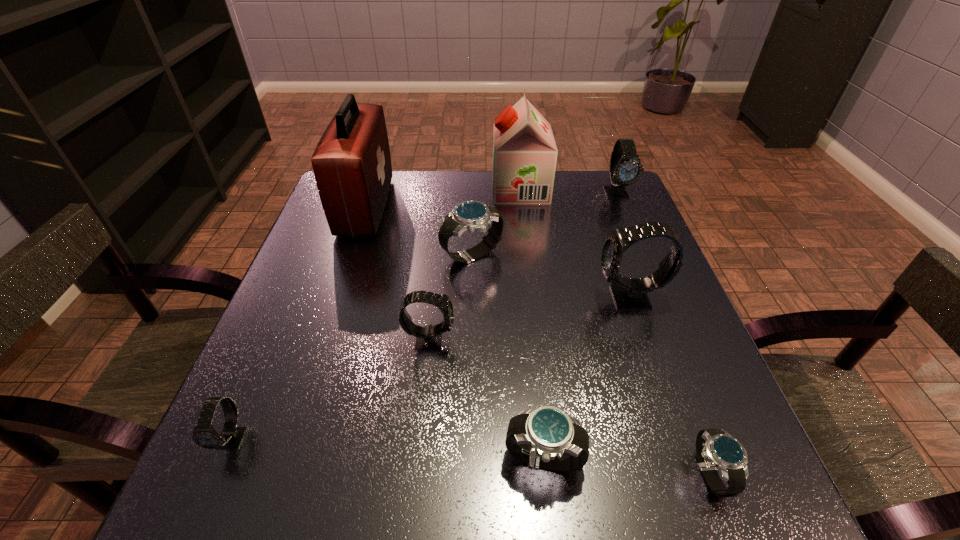
Where is `the fourth nearest object`? The image size is (960, 540). the fourth nearest object is located at coordinates (428, 337).

Identify the location of the second smallest silver watch. Image resolution: width=960 pixels, height=540 pixels. (546, 437).

Where is `the leftmost gray watch`? This screenshot has width=960, height=540. the leftmost gray watch is located at coordinates (204, 435).

Identify the location of the leftmost watch. Image resolution: width=960 pixels, height=540 pixels. (204, 435).

Where is `the smallest silver watch`? the smallest silver watch is located at coordinates (715, 448).

Where is `the shortest object`? the shortest object is located at coordinates (715, 448).

Locate an element on the screen. This screenshot has width=960, height=540. vacant point located on the side of the first aid kit with the cross symbol is located at coordinates (483, 207).

Find the location of a particular element. This screenshot has width=960, height=540. vacant area situated with the cap open on the soya milk is located at coordinates (407, 189).

Where is `vacant space located 0.180m with the cap open on the soya milk`? The image size is (960, 540). vacant space located 0.180m with the cap open on the soya milk is located at coordinates (428, 189).

The image size is (960, 540). I want to click on free space located 0.290m with the cap open on the soya milk, so click(x=389, y=189).